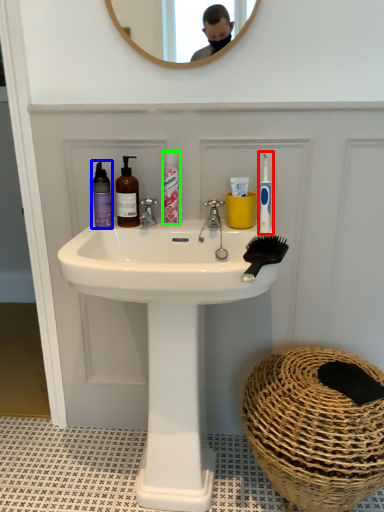
Question: Which object is the closest to the toothbrush (highlighted by a red box)? Choose among these: mouthwash (highlighted by a blue box) or mouthwash (highlighted by a green box).

Choices:
 (A) mouthwash
 (B) mouthwash

Answer: (B)